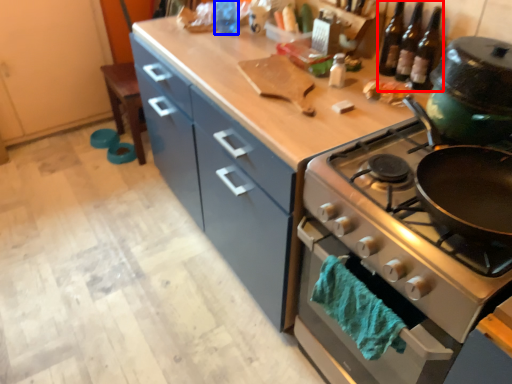
Question: Which of the following is the closest to the observer, wine bottle (highlighted by a red box) or bottle (highlighted by a blue box)?

Choices:
 (A) wine bottle
 (B) bottle

Answer: (A)